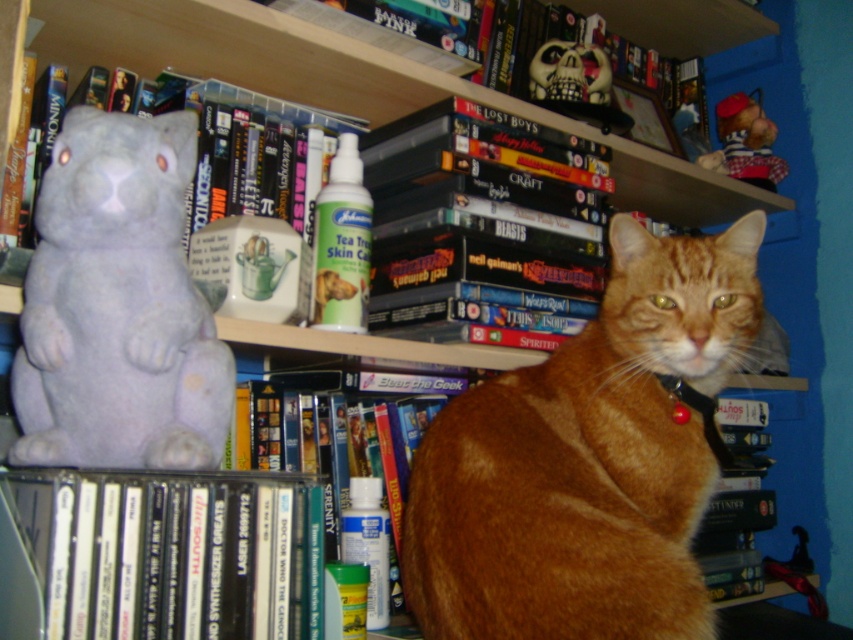
Question: Can you confirm if orange fur cat at center is thinner than red plastic collar at center?

Choices:
 (A) yes
 (B) no

Answer: (B)

Question: Which of the following is the closest to the observer?

Choices:
 (A) (181, 422)
 (B) (541, 310)
 (C) (172, 513)

Answer: (C)

Question: Is black matte book at lower left thinner than red plush bear at upper right?

Choices:
 (A) yes
 (B) no

Answer: (B)

Question: Estimate the real-world distances between objects in this image. Which object is farther from the red plastic collar at center?

Choices:
 (A) hardcover book at center
 (B) black matte book at lower left

Answer: (B)

Question: Is orange fur cat at center above white ceramic bear at left?

Choices:
 (A) yes
 (B) no

Answer: (B)

Question: Which is farther from the hardcover book at center?

Choices:
 (A) black matte book at lower left
 (B) purple fabric stuffed animal at left
 (C) orange fur cat at center

Answer: (A)